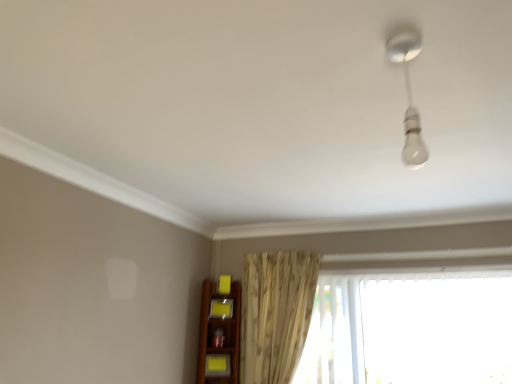
Question: Is there a large distance between yellow matte shelf at lower center, the 2th shelf in the bottom-to-top sequence, and transparent plastic window at lower right?

Choices:
 (A) no
 (B) yes

Answer: (B)

Question: From the image's perspective, would you say yellow matte shelf at lower center, which ranks as the 2th shelf in front-to-back order, is shown under transparent plastic window at lower right?

Choices:
 (A) no
 (B) yes

Answer: (A)

Question: Does yellow matte shelf at lower center, which appears as the first shelf when viewed from the back, have a larger size compared to transparent plastic window at lower right?

Choices:
 (A) no
 (B) yes

Answer: (A)

Question: Is yellow matte shelf at lower center, which ranks as the 2th shelf in front-to-back order, closer to camera compared to transparent plastic window at lower right?

Choices:
 (A) no
 (B) yes

Answer: (A)

Question: Is yellow matte shelf at lower center, the 2th shelf in the bottom-to-top sequence, at the right side of transparent plastic window at lower right?

Choices:
 (A) yes
 (B) no

Answer: (B)

Question: In terms of height, does matte yellow shelf at lower center, which is the first shelf in front-to-back order, look taller or shorter compared to yellow matte shelf at lower center, acting as the first shelf starting from the top?

Choices:
 (A) tall
 (B) short

Answer: (A)

Question: Is point (226, 365) positioned closer to the camera than point (214, 316)?

Choices:
 (A) closer
 (B) farther

Answer: (A)

Question: In terms of width, does matte yellow shelf at lower center, which is the first shelf in front-to-back order, look wider or thinner when compared to yellow matte shelf at lower center, the 2th shelf in the bottom-to-top sequence?

Choices:
 (A) wide
 (B) thin

Answer: (A)

Question: Considering their positions, is matte yellow shelf at lower center, positioned as the 2th shelf in back-to-front order, located in front of or behind yellow matte shelf at lower center, which ranks as the 2th shelf in front-to-back order?

Choices:
 (A) front
 (B) behind

Answer: (A)

Question: In terms of size, does yellow matte shelf at lower center, acting as the first shelf starting from the top, appear bigger or smaller than transparent plastic window at lower right?

Choices:
 (A) small
 (B) big

Answer: (A)

Question: From a real-world perspective, is yellow matte shelf at lower center, which appears as the first shelf when viewed from the back, above or below transparent plastic window at lower right?

Choices:
 (A) below
 (B) above

Answer: (B)

Question: Based on their positions, is yellow matte shelf at lower center, acting as the first shelf starting from the top, located to the left or right of transparent plastic window at lower right?

Choices:
 (A) right
 (B) left

Answer: (B)

Question: Is yellow matte shelf at lower center, acting as the first shelf starting from the top, spatially inside transparent plastic window at lower right, or outside of it?

Choices:
 (A) outside
 (B) inside

Answer: (A)

Question: Looking at their shapes, would you say beige textured curtain at center is wider or thinner than transparent plastic window at lower right?

Choices:
 (A) wide
 (B) thin

Answer: (A)

Question: Considering the relative positions of beige textured curtain at center and transparent plastic window at lower right in the image provided, is beige textured curtain at center to the left or to the right of transparent plastic window at lower right?

Choices:
 (A) right
 (B) left

Answer: (B)